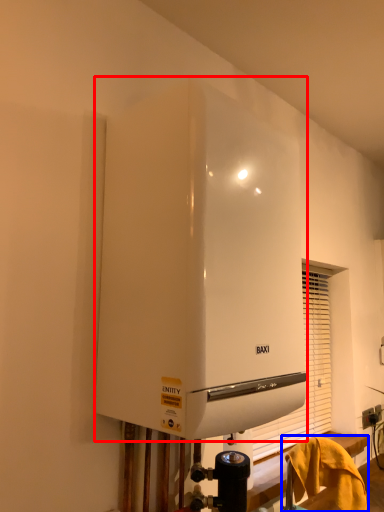
Question: Which point is closer to the camera, home appliance (highlighted by a red box) or furniture (highlighted by a blue box)?

Choices:
 (A) home appliance
 (B) furniture

Answer: (A)